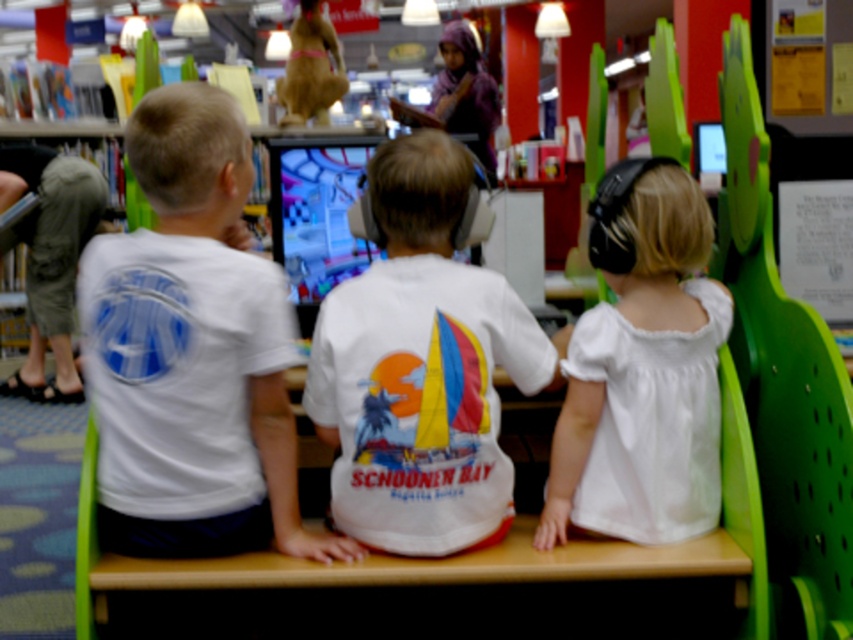
Who is positioned more to the left, white matte t-shirt at left or white satin dress at center?

white matte t-shirt at left

Can you confirm if white matte t-shirt at left is shorter than white satin dress at center?

No.

What do you see at coordinates (192, 349) in the screenshot?
I see `white matte t-shirt at left` at bounding box center [192, 349].

Where is `white matte t-shirt at left`? This screenshot has width=853, height=640. white matte t-shirt at left is located at coordinates (192, 349).

In the scene shown: Measure the distance between white satin dress at center and camera.

white satin dress at center is 6.71 feet away from camera.

Is point (680, 536) less distant than point (746, 36)?

Yes, point (680, 536) is closer to viewer.

The image size is (853, 640). What are the coordinates of `white satin dress at center` in the screenshot? It's located at (642, 369).

From the picture: Can you confirm if white matte t-shirt at center is wider than green plastic chair at right?

Correct, the width of white matte t-shirt at center exceeds that of green plastic chair at right.

Which is behind, point (450, 177) or point (735, 172)?

The point (735, 172) is behind.

Where is `white matte t-shirt at center`? The image size is (853, 640). white matte t-shirt at center is located at coordinates (421, 365).